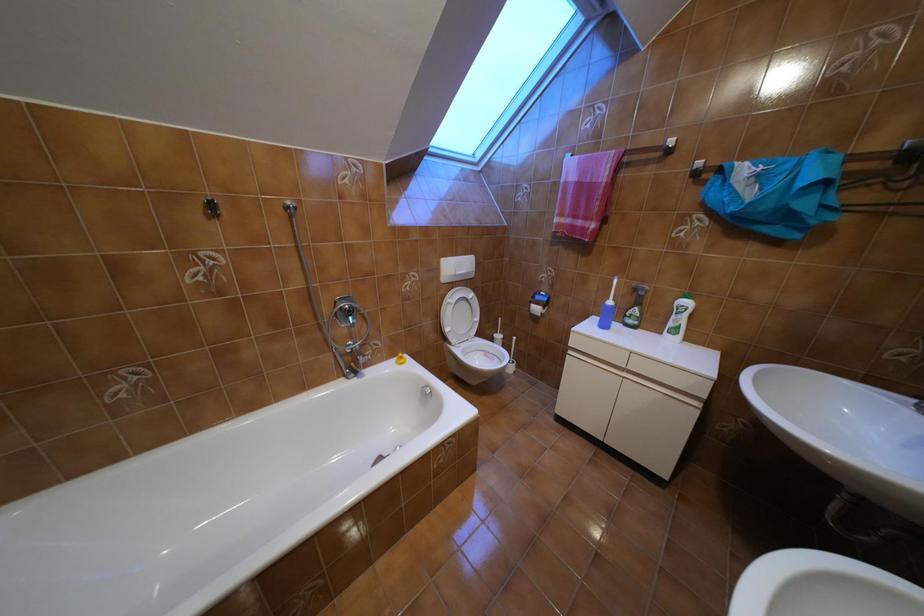
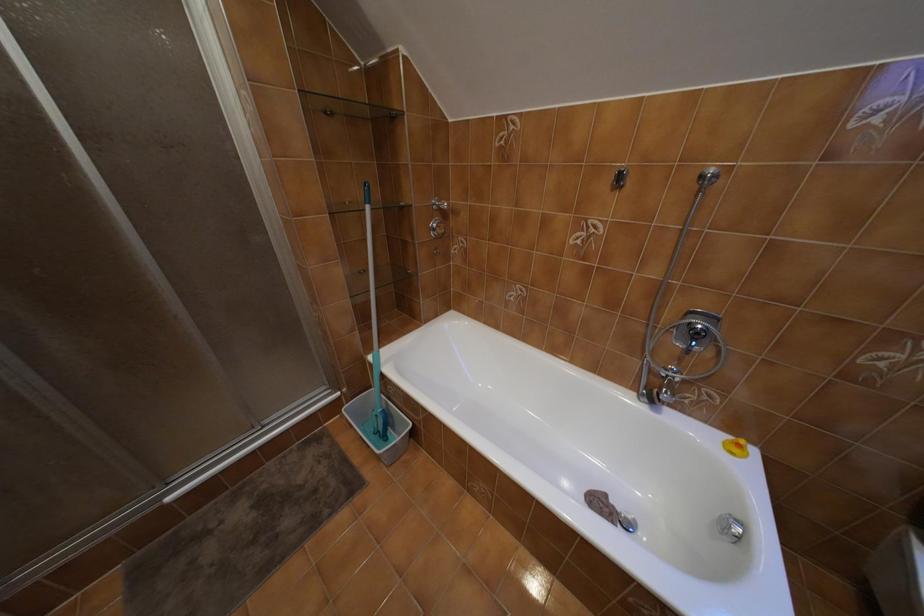
First-person continuous shooting, in which direction is the camera rotating?

The rotation direction of the camera is left-down.